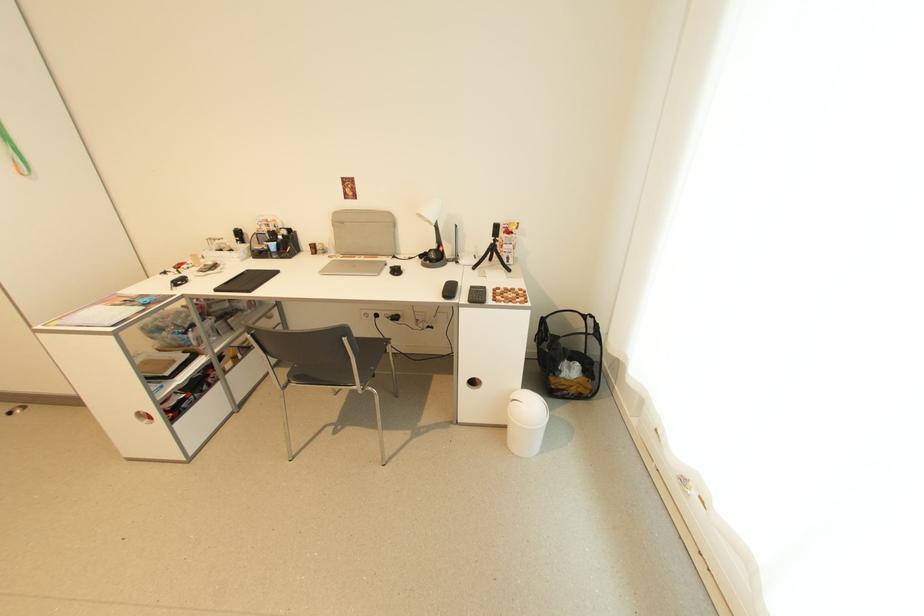
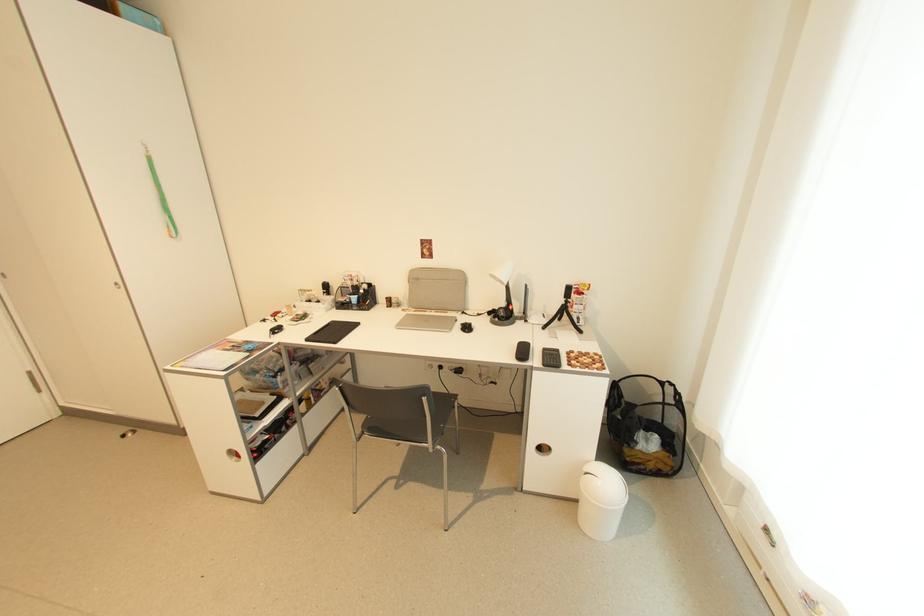
In the second image, find the point that corresponds to (566,377) in the first image.

(642, 450)